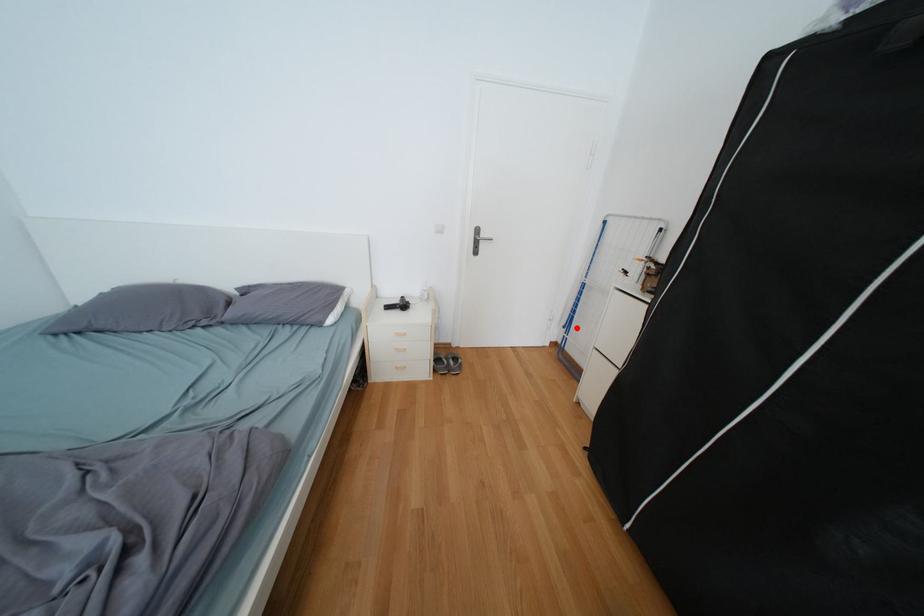
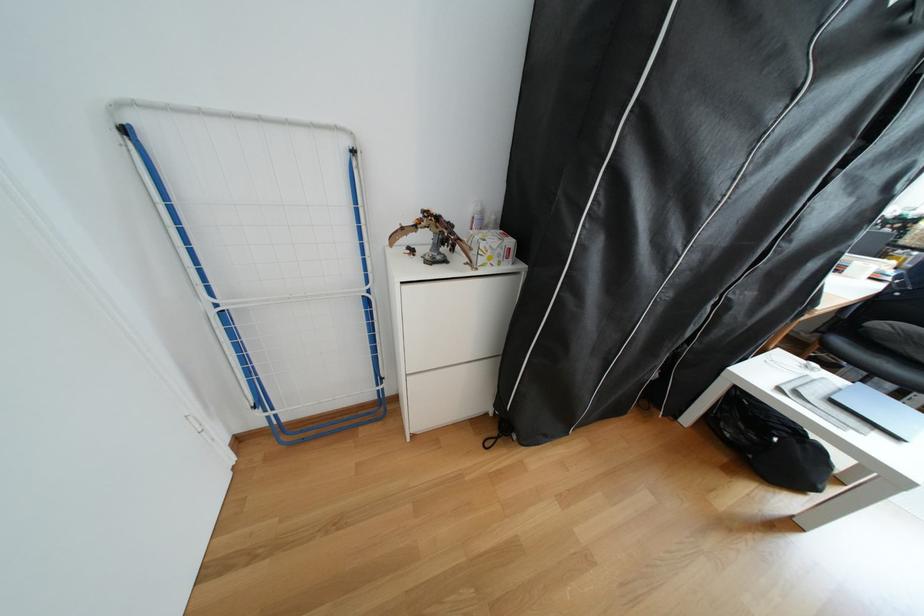
Question: I am providing you with two images of the same scene from different viewpoints. In image1, a red point is highlighted. Considering the same 3D point in image2, which of the following is correct?

Choices:
 (A) It is closer
 (B) It is farther

Answer: (A)